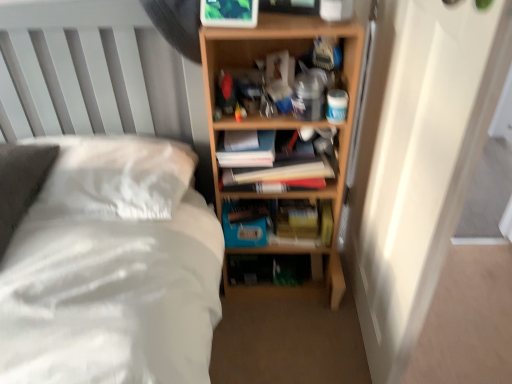
Question: In terms of height, does blue matte paperback book at center look taller or shorter compared to white soft bed at center?

Choices:
 (A) tall
 (B) short

Answer: (B)

Question: Considering the positions of blue matte paperback book at center and white soft bed at center in the image, is blue matte paperback book at center bigger or smaller than white soft bed at center?

Choices:
 (A) big
 (B) small

Answer: (B)

Question: Which is farther from the wooden bookshelf at center?

Choices:
 (A) hardcover books at center
 (B) white soft bed at center
 (C) blue matte paperback book at center

Answer: (B)

Question: Based on their relative distances, which object is nearer to the wooden bookshelf at center?

Choices:
 (A) hardcover books at center
 (B) white soft bed at center
 (C) blue matte paperback book at center

Answer: (A)